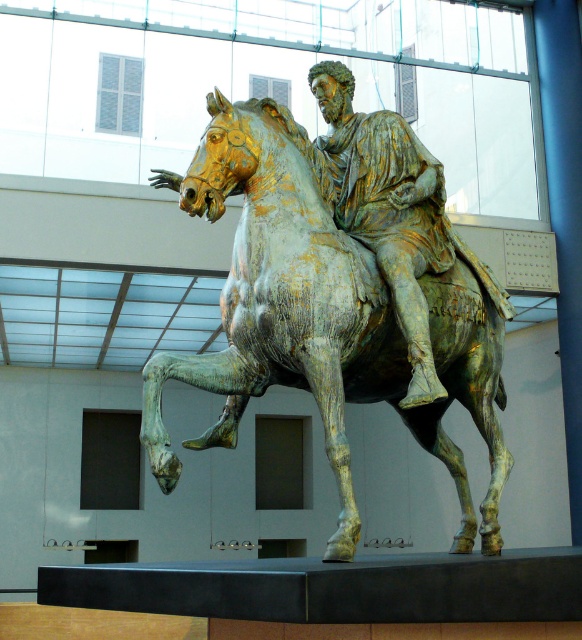
Consider the image. You are standing in front of the equestrian bronze statue. There are two points marked on the statue, one at coordinates point (359, 240) and the other at point (393, 129). Which of these two points is closer to you?

Point (359, 240) is closer to the viewer than point (393, 129).

You are an art conservator examining the gold patina bronze horse and rider at center in the museum. You notice a specific point marked at coordinates (340, 291). What does this point indicate about the statue?

The point at coordinates (340, 291) indicates the location of the gold patina bronze horse and rider at center.